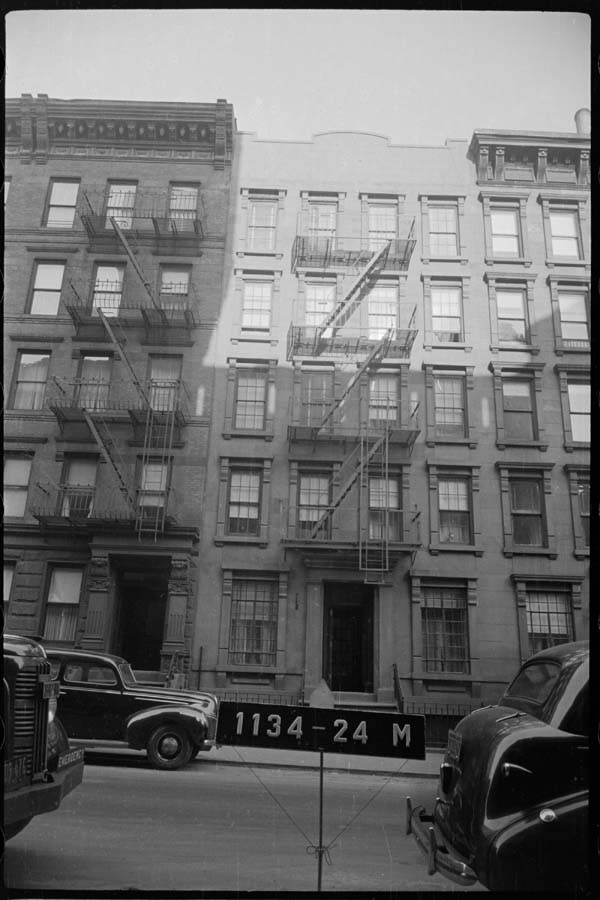
In order to click on window in this screenshot , I will do `click(451, 636)`.